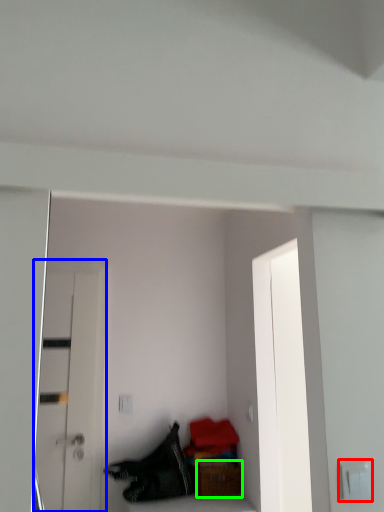
Question: Which is nearer to the electric outlet (highlighted by a red box)? door (highlighted by a blue box) or furniture (highlighted by a green box).

Choices:
 (A) door
 (B) furniture

Answer: (B)